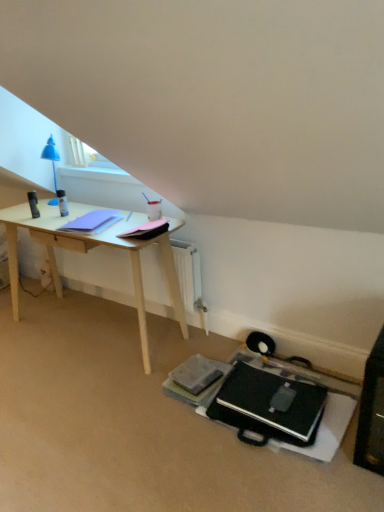
Question: Looking at the image, does black matte laptop at lower center seem bigger or smaller compared to pink matte notepad at center, which appears as the 1th notepad when viewed from the right?

Choices:
 (A) small
 (B) big

Answer: (B)

Question: Does point (249, 381) appear closer or farther from the camera than point (137, 228)?

Choices:
 (A) farther
 (B) closer

Answer: (B)

Question: Which object is the farthest from the pink matte notepad at center, which appears as the 1th notepad when viewed from the right?

Choices:
 (A) matte purple notepad at left, the first notepad from the left
 (B) black matte laptop at lower center

Answer: (B)

Question: Estimate the real-world distances between objects in this image. Which object is closer to the black matte laptop at lower center?

Choices:
 (A) matte purple notepad at left, the first notepad from the left
 (B) pink matte notepad at center, the 2th notepad positioned from the left

Answer: (B)